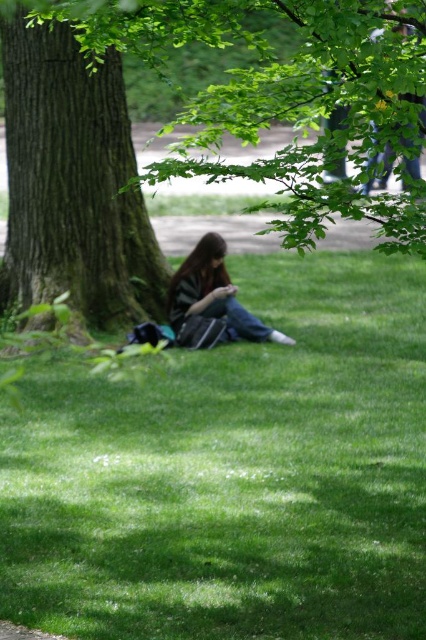
You are standing in the park and want to sit down on the green grass at lower left. However, there is a green leafy tree at center above it. Do you think the tree will provide shade for you when you sit there?

The green grass at lower left is below the green leafy tree at center, so yes, the tree will provide shade for you when you sit there.

Looking at this image, you are planning to take a photo of the striped fabric shirt at center and the dark brown textured tree trunk at left. Which object should you focus on first if you want both to be in sharp focus?

The dark brown textured tree trunk at left is larger in size than the striped fabric shirt at center, so you should focus on the larger object first to ensure both are in sharp focus.